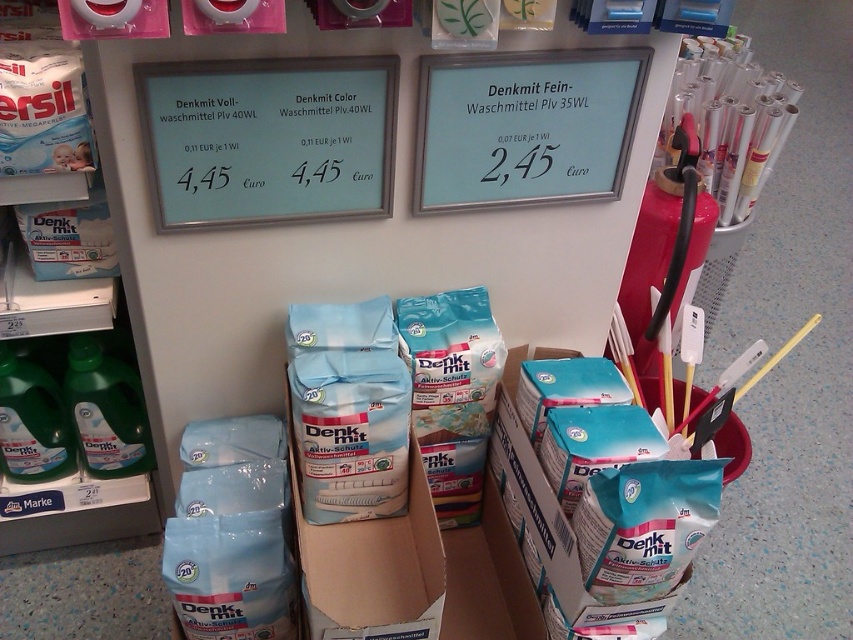
From the picture: Is white plastic straws at upper right wider than green plastic bottle at lower left?

Yes.

Which is more to the right, white plastic straws at upper right or green plastic bottle at lower left?

white plastic straws at upper right is more to the right.

Locate an element on the screen. The width and height of the screenshot is (853, 640). white plastic straws at upper right is located at coordinates (730, 118).

Locate an element on the screen. white plastic straws at upper right is located at coordinates (730, 118).

Between blue plastic sign at center and white plastic straws at upper right, which one has less height?

Standing shorter between the two is blue plastic sign at center.

Is blue plastic sign at center further to camera compared to white plastic straws at upper right?

No, blue plastic sign at center is in front of white plastic straws at upper right.

Which is behind, point (535, 141) or point (730, 36)?

The point (730, 36) is more distant.

At what (x,y) coordinates should I click in order to perform the action: click on blue plastic sign at center. Please return your answer as a coordinate pair (x, y). Looking at the image, I should click on (524, 128).

Is blue plastic sign at center smaller than green plastic bottle at lower left?

No.

Who is more forward, (476, 68) or (0, 380)?

Positioned in front is point (476, 68).

Image resolution: width=853 pixels, height=640 pixels. I want to click on blue plastic sign at center, so click(x=524, y=128).